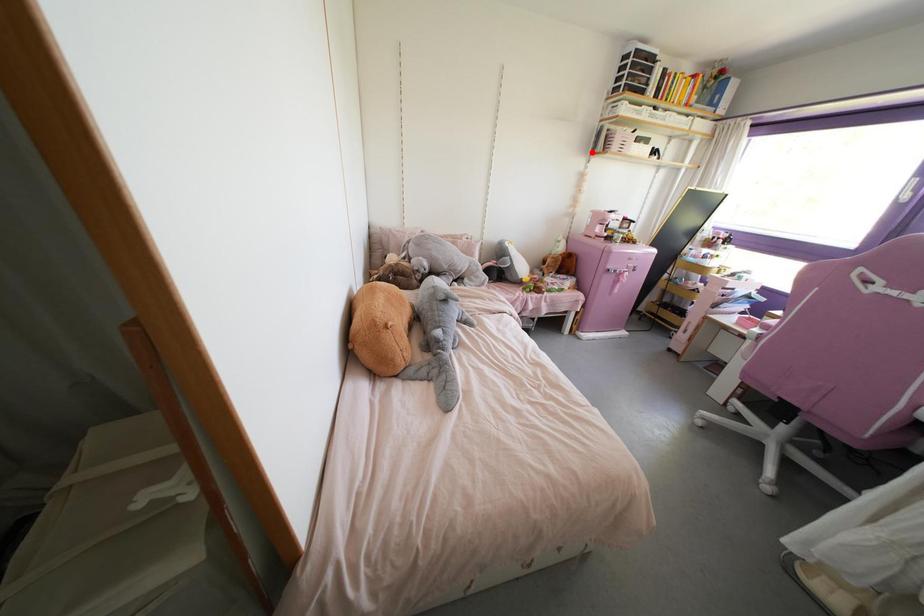
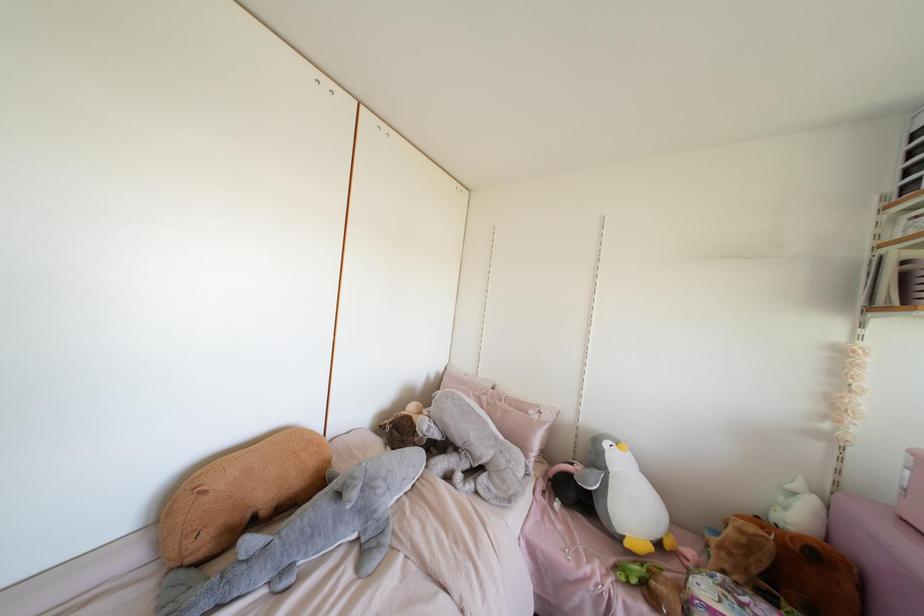
Question: I am providing you with two images of the same scene from different viewpoints. Given a red point in image1, look at the same physical point in image2. Is it:

Choices:
 (A) Closer to the viewpoint
 (B) Farther from the viewpoint

Answer: (B)